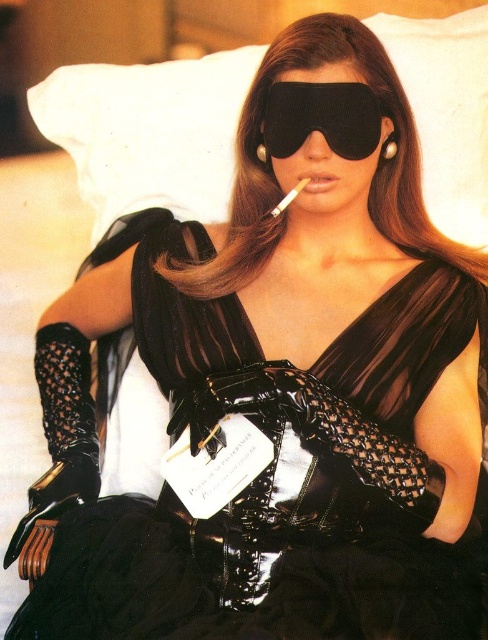
Question: Is the position of black glossy dress at center less distant than that of black matte goggles at center?

Choices:
 (A) no
 (B) yes

Answer: (B)

Question: Which object is positioned closest to the black matte goggles at center?

Choices:
 (A) white fabric pillow at upper center
 (B) matte black lips at center
 (C) black glossy dress at center

Answer: (B)

Question: Which point is closer to the camera?

Choices:
 (A) black glossy dress at center
 (B) matte black lips at center
 (C) white fabric pillow at upper center

Answer: (A)

Question: Does black glossy dress at center appear on the left side of white fabric pillow at upper center?

Choices:
 (A) yes
 (B) no

Answer: (A)

Question: Which point is closer to the camera?

Choices:
 (A) black glossy dress at center
 (B) matte black lips at center

Answer: (A)

Question: Does white fabric pillow at upper center have a smaller size compared to matte black lips at center?

Choices:
 (A) yes
 (B) no

Answer: (B)